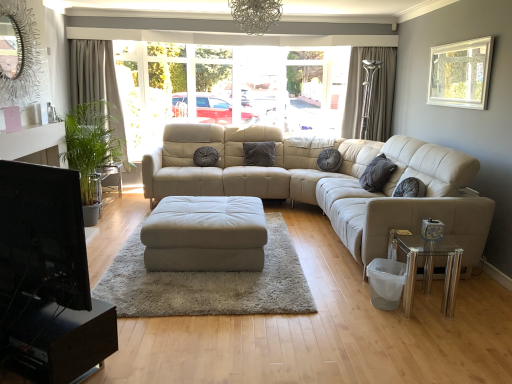
Question: Looking at their shapes, would you say white glossy side table at left is wider or thinner than transparent glass table at lower right?

Choices:
 (A) thin
 (B) wide

Answer: (B)

Question: Considering the relative positions of white glossy side table at left and transparent glass table at lower right in the image provided, is white glossy side table at left to the left or to the right of transparent glass table at lower right?

Choices:
 (A) left
 (B) right

Answer: (A)

Question: Estimate the real-world distances between objects in this image. Which object is closer to the beige fabric curtain at left, which is counted as the 1th curtain, starting from the left?

Choices:
 (A) silky gray curtain at right, which appears as the 1th curtain when viewed from the right
 (B) velvet gray pillow at center, arranged as the first pillow when viewed from the back
 (C) black glossy tv at lower left
 (D) gray matte pillow at center, which is the 3th pillow from left to right
 (E) white leather ottoman at center

Answer: (B)

Question: Which of these objects is positioned farthest from the gray matte pillow at center, which is the 3th pillow from left to right?

Choices:
 (A) beige fabric curtain at left, which is counted as the 1th curtain, starting from the left
 (B) white framed window at upper right
 (C) suede-like dark gray pillow at center, which is the first pillow in left-to-right order
 (D) transparent glass table at lower right
 (E) white leather ottoman at center

Answer: (A)